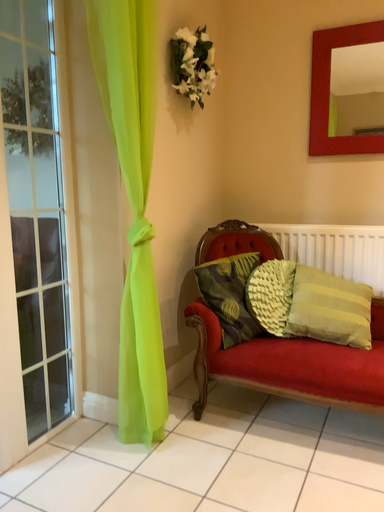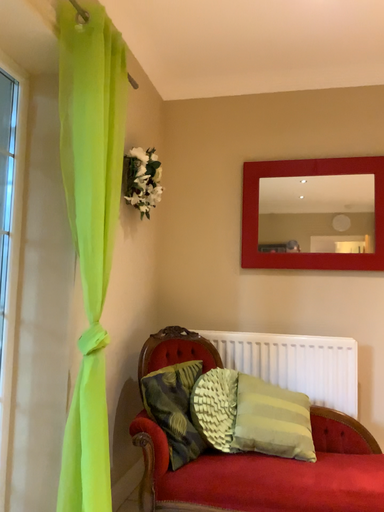
Question: How did the camera likely rotate when shooting the video?

Choices:
 (A) rotated downward
 (B) rotated upward

Answer: (B)